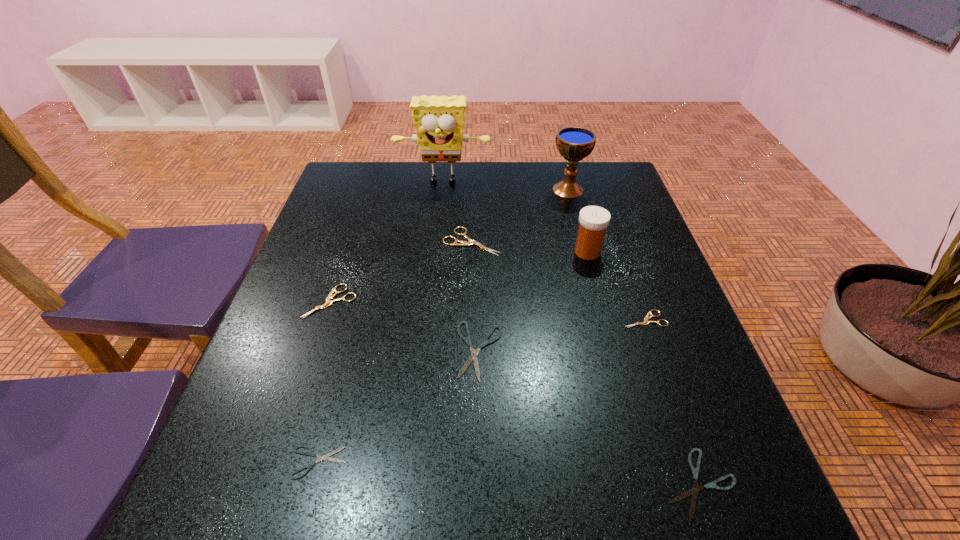
This screenshot has width=960, height=540. In order to click on blank region between the rightmost black shears and the smallest beige shears in this screenshot , I will do `click(672, 401)`.

The height and width of the screenshot is (540, 960). Find the location of `free area in between the smallest beige shears and the second biggest beige shears`. free area in between the smallest beige shears and the second biggest beige shears is located at coordinates (488, 310).

This screenshot has width=960, height=540. I want to click on free space between the second smallest black shears and the yellow sponge, so click(571, 333).

I want to click on vacant area that lies between the farthest black shears and the rightmost beige shears, so click(x=562, y=335).

Find the location of `vacant space that is in between the biggest black shears and the yellow sponge`. vacant space that is in between the biggest black shears and the yellow sponge is located at coordinates [x=462, y=266].

The height and width of the screenshot is (540, 960). What are the coordinates of `vacant area between the smallest beige shears and the biggest beige shears` in the screenshot? It's located at 558,280.

Locate an element on the screen. The height and width of the screenshot is (540, 960). free space between the third tallest object and the smallest beige shears is located at coordinates (616, 286).

Locate an element on the screen. vacant area between the rightmost beige shears and the medicine is located at coordinates (616, 286).

Find the location of a particular element. free area in between the second smallest black shears and the third tallest object is located at coordinates (643, 367).

Where is `object that is the closest to the sixth shortest object`? Image resolution: width=960 pixels, height=540 pixels. object that is the closest to the sixth shortest object is located at coordinates (439, 121).